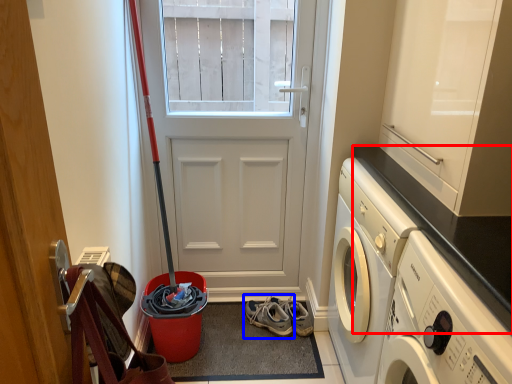
Question: Which object appears closest to the camera in this image, counter top (highlighted by a red box) or footwear (highlighted by a blue box)?

Choices:
 (A) counter top
 (B) footwear

Answer: (A)